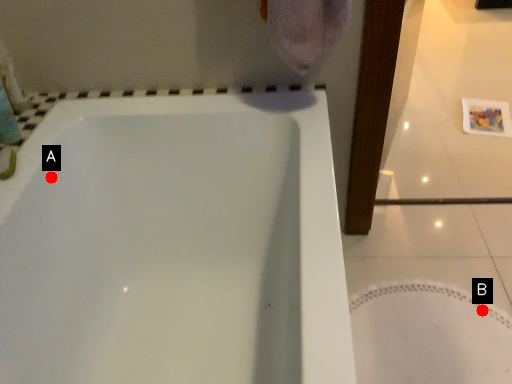
Question: Two points are circled on the image, labeled by A and B beside each circle. Which of the following is the farthest from the observer?

Choices:
 (A) A is further
 (B) B is further

Answer: (B)